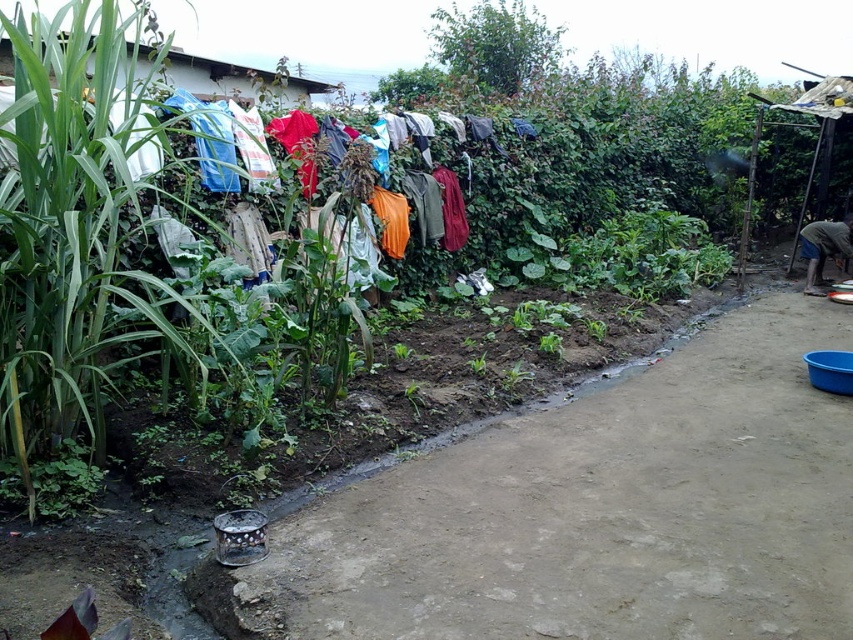
Question: From the image, what is the correct spatial relationship of dark brown fabric at lower right in relation to green leafy plant at center?

Choices:
 (A) right
 (B) left

Answer: (A)

Question: Is dark brown fabric at lower right bigger than green leafy plant at center?

Choices:
 (A) no
 (B) yes

Answer: (B)

Question: Estimate the real-world distances between objects in this image. Which object is closer to the dark brown fabric at lower right?

Choices:
 (A) green leafy plant at left
 (B) green leafy plant at center

Answer: (B)

Question: Which point is farther to the camera?

Choices:
 (A) (479, 368)
 (B) (843, 248)
 (C) (33, 44)

Answer: (B)

Question: Which point is farther to the camera?

Choices:
 (A) dark brown fabric at lower right
 (B) green leafy plant at left

Answer: (A)

Question: Is green leafy plant at left closer to camera compared to dark brown fabric at lower right?

Choices:
 (A) no
 (B) yes

Answer: (B)